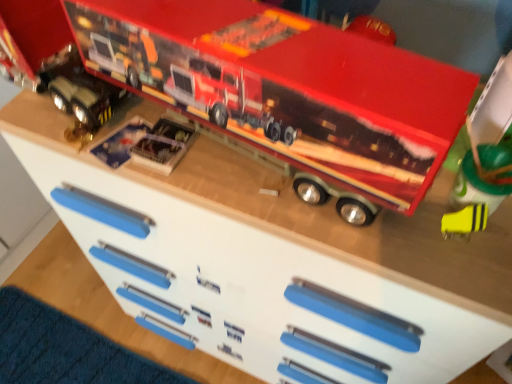
Question: Can you confirm if metallic silver toy truck at center, arranged as the 1th toy when viewed from the left, is thinner than yellow matte eraser at lower right, which is the fourth toy from left to right?

Choices:
 (A) yes
 (B) no

Answer: (B)

Question: Is metallic silver toy truck at center, arranged as the 1th toy when viewed from the left, facing towards yellow matte eraser at lower right, placed as the first toy when sorted from right to left?

Choices:
 (A) yes
 (B) no

Answer: (B)

Question: Is metallic silver toy truck at center, arranged as the 1th toy when viewed from the left, positioned beyond the bounds of yellow matte eraser at lower right, placed as the first toy when sorted from right to left?

Choices:
 (A) no
 (B) yes

Answer: (B)

Question: Is yellow matte eraser at lower right, which is the fourth toy from left to right, surrounded by metallic silver toy truck at center, arranged as the 1th toy when viewed from the left?

Choices:
 (A) yes
 (B) no

Answer: (B)

Question: Considering the relative positions of metallic silver toy truck at center, arranged as the 1th toy when viewed from the left, and yellow matte eraser at lower right, placed as the first toy when sorted from right to left, in the image provided, is metallic silver toy truck at center, arranged as the 1th toy when viewed from the left, to the right of yellow matte eraser at lower right, placed as the first toy when sorted from right to left, from the viewer's perspective?

Choices:
 (A) yes
 (B) no

Answer: (B)

Question: From the image's perspective, is yellow matte eraser at lower right, placed as the first toy when sorted from right to left, located above or below metallic silver toy truck at center, arranged as the 1th toy when viewed from the left?

Choices:
 (A) above
 (B) below

Answer: (B)

Question: Based on their sizes in the image, would you say yellow matte eraser at lower right, placed as the first toy when sorted from right to left, is bigger or smaller than metallic silver toy truck at center, arranged as the 1th toy when viewed from the left?

Choices:
 (A) big
 (B) small

Answer: (A)

Question: Looking at their shapes, would you say yellow matte eraser at lower right, which is the fourth toy from left to right, is wider or thinner than metallic silver toy truck at center, positioned as the fourth toy in right-to-left order?

Choices:
 (A) thin
 (B) wide

Answer: (A)

Question: From a real-world perspective, relative to metallic silver toy truck at center, arranged as the 1th toy when viewed from the left, is yellow matte eraser at lower right, placed as the first toy when sorted from right to left, vertically above or below?

Choices:
 (A) below
 (B) above

Answer: (B)

Question: Is point (115, 61) closer or farther from the camera than point (140, 160)?

Choices:
 (A) farther
 (B) closer

Answer: (B)

Question: In the image, is metallic red truck at upper center, which ranks as the 2th toy in right-to-left order, on the left side or the right side of clear plastic toy at center, marked as the second toy in a left-to-right arrangement?

Choices:
 (A) left
 (B) right

Answer: (B)

Question: Is metallic red truck at upper center, which ranks as the 2th toy in right-to-left order, wider or thinner than clear plastic toy at center, which is counted as the third toy, starting from the right?

Choices:
 (A) wide
 (B) thin

Answer: (A)

Question: Considering their positions, is metallic red truck at upper center, which ranks as the 2th toy in right-to-left order, located in front of or behind clear plastic toy at center, which is counted as the third toy, starting from the right?

Choices:
 (A) front
 (B) behind

Answer: (A)

Question: In the image, is yellow matte eraser at lower right, which is the fourth toy from left to right, positioned in front of or behind metallic red truck at upper center, which ranks as the 2th toy in right-to-left order?

Choices:
 (A) behind
 (B) front

Answer: (A)

Question: Based on their positions, is yellow matte eraser at lower right, which is the fourth toy from left to right, located to the left or right of metallic red truck at upper center, placed as the 3th toy when sorted from left to right?

Choices:
 (A) left
 (B) right

Answer: (B)